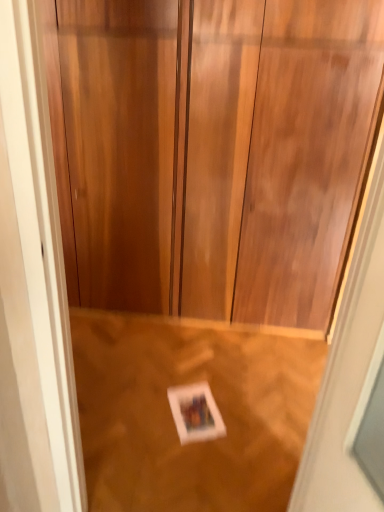
Locate an element on the screen. vacant area situated below white paper at center (from a real-world perspective) is located at coordinates (191, 407).